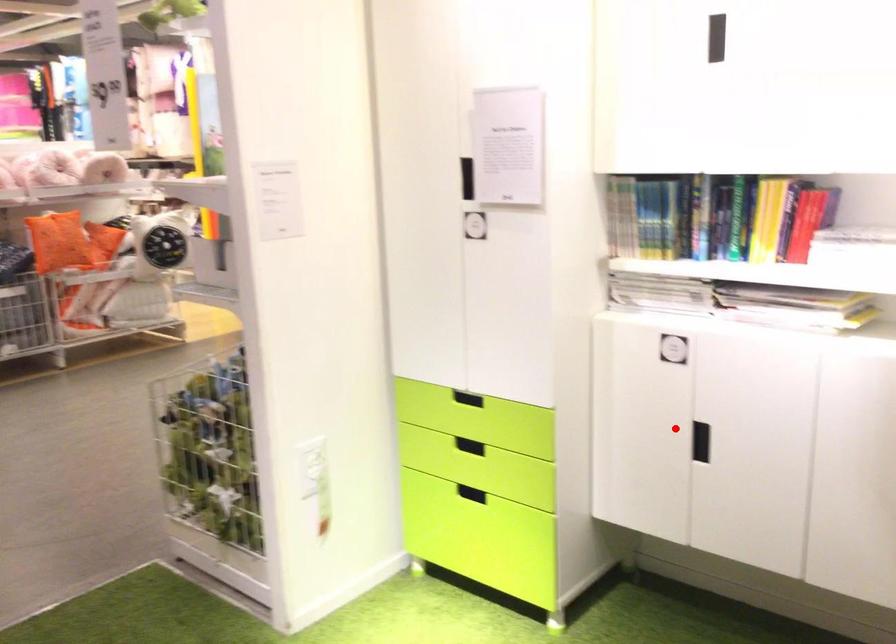
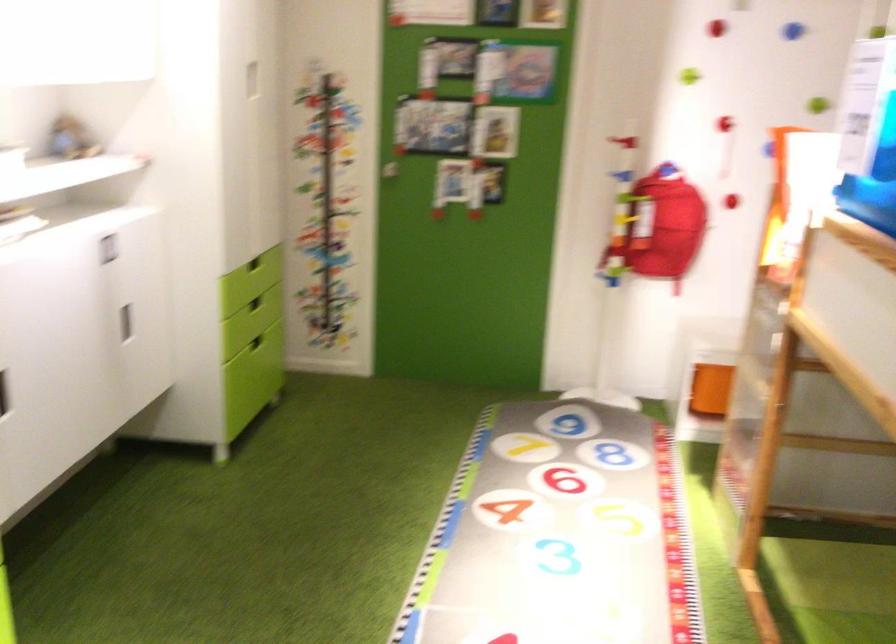
Where in the second image is the point corresponding to the highlighted location from the first image?

(3, 393)